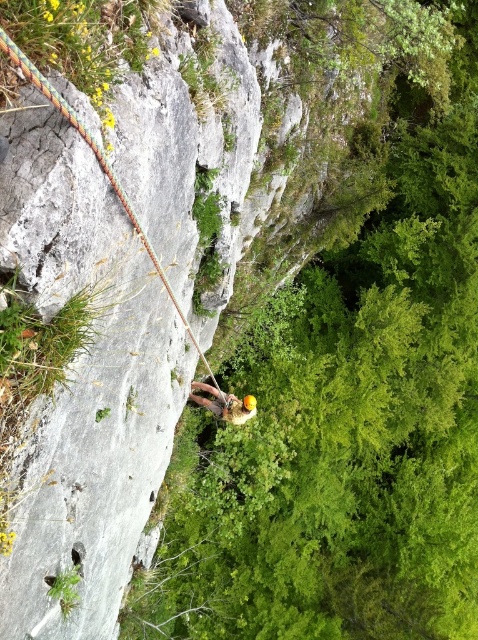
Question: Does multicolored braided rope at left have a greater width compared to yellow helmet at center?

Choices:
 (A) no
 (B) yes

Answer: (A)

Question: Which point is farther to the camera?

Choices:
 (A) multicolored braided rope at left
 (B) yellow helmet at center

Answer: (B)

Question: Is multicolored braided rope at left positioned before yellow helmet at center?

Choices:
 (A) no
 (B) yes

Answer: (B)

Question: Which point is closer to the camera taking this photo?

Choices:
 (A) (140, 228)
 (B) (235, 403)

Answer: (A)

Question: Is multicolored braided rope at left above yellow helmet at center?

Choices:
 (A) yes
 (B) no

Answer: (A)